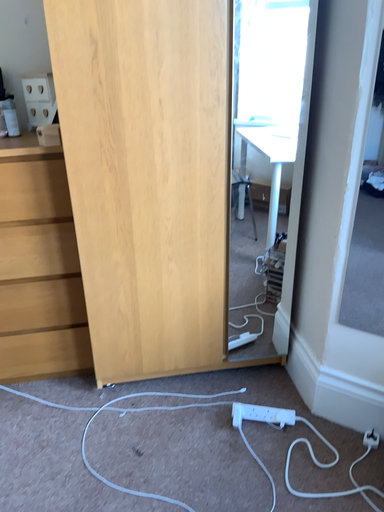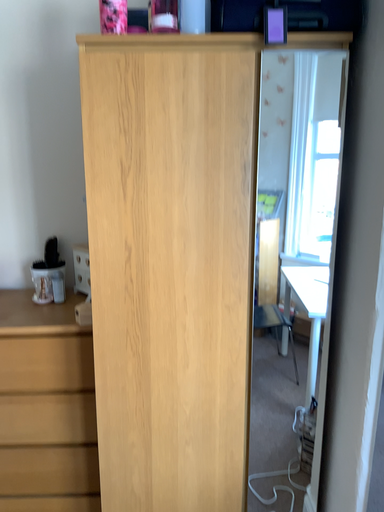
Question: How did the camera likely rotate when shooting the video?

Choices:
 (A) rotated right
 (B) rotated left

Answer: (B)